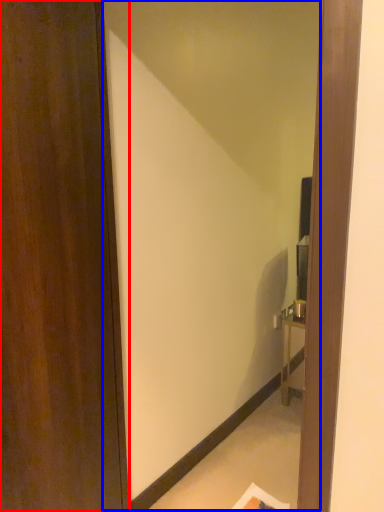
Question: Which point is closer to the camera, door (highlighted by a red box) or mirror (highlighted by a blue box)?

Choices:
 (A) door
 (B) mirror

Answer: (A)